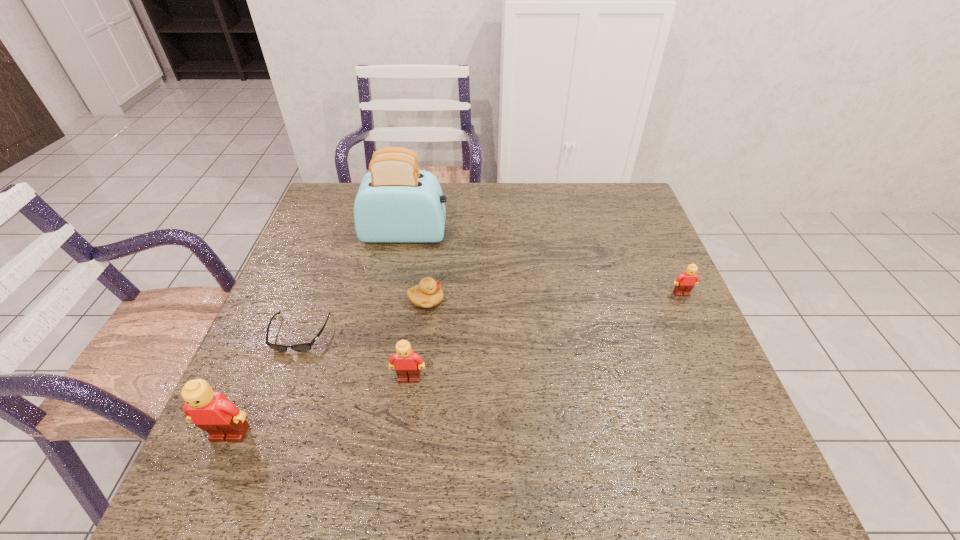
What are the coordinates of `blank region between the duckling and the tallest Lego` in the screenshot? It's located at (328, 367).

Identify the location of empty location between the third nearest object and the second farthest Lego. (354, 356).

Identify the location of vacant region between the farthest object and the shortest Lego. The height and width of the screenshot is (540, 960). (543, 264).

The width and height of the screenshot is (960, 540). Identify the location of vacant point located between the second tallest object and the shortest object. (265, 384).

At what (x,y) coordinates should I click in order to perform the action: click on free space between the third nearest object and the tallest Lego. Please return your answer as a coordinate pair (x, y). This screenshot has width=960, height=540. Looking at the image, I should click on (265, 384).

Locate an element on the screen. Image resolution: width=960 pixels, height=540 pixels. free space between the duckling and the rightmost Lego is located at coordinates (554, 297).

The width and height of the screenshot is (960, 540). I want to click on unoccupied area between the duckling and the nearest Lego, so click(x=328, y=367).

Where is `object that is the second closest to the second nearest object`? object that is the second closest to the second nearest object is located at coordinates (304, 347).

Choose which object is the fourth nearest neighbor to the rightmost object. Please provide its 2D coordinates. Your answer should be formatted as a tuple, i.e. [(x, y)], where the tuple contains the x and y coordinates of a point satisfying the conditions above.

[(304, 347)]

Identify which Lego is the second nearest to the second tallest Lego. Please provide its 2D coordinates. Your answer should be formatted as a tuple, i.e. [(x, y)], where the tuple contains the x and y coordinates of a point satisfying the conditions above.

[(685, 282)]